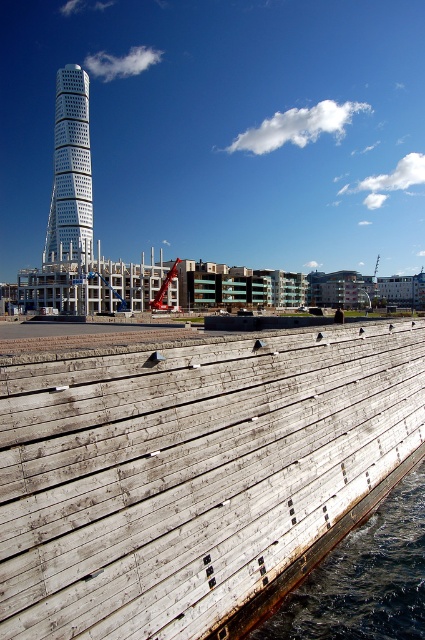
The image size is (425, 640). Identify the location of dark blue water at lower right. (363, 579).

The width and height of the screenshot is (425, 640). In order to click on dark blue water at lower right in this screenshot , I will do `click(363, 579)`.

Identify the location of dark blue water at lower right. (363, 579).

Between weathered wood dock at lower left and dark blue water at lower right, which one has less height?

dark blue water at lower right is shorter.

Can you confirm if weathered wood dock at lower left is taller than dark blue water at lower right?

Correct, weathered wood dock at lower left is much taller as dark blue water at lower right.

Image resolution: width=425 pixels, height=640 pixels. In order to click on weathered wood dock at lower left in this screenshot , I will do `click(192, 472)`.

What are the coordinates of `weathered wood dock at lower left` in the screenshot? It's located at (192, 472).

Is weathered wood dock at lower left to the left of white glass tower at upper left from the viewer's perspective?

In fact, weathered wood dock at lower left is to the right of white glass tower at upper left.

Does weathered wood dock at lower left have a lesser width compared to white glass tower at upper left?

Indeed, weathered wood dock at lower left has a lesser width compared to white glass tower at upper left.

This screenshot has width=425, height=640. Describe the element at coordinates (192, 472) in the screenshot. I see `weathered wood dock at lower left` at that location.

Locate an element on the screen. weathered wood dock at lower left is located at coordinates (192, 472).